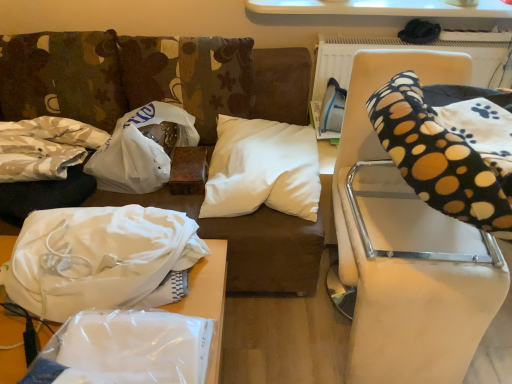
Question: Is transparent plastic bag at lower left, acting as the second furniture starting from the right, surrounding white fabric at left, which ranks as the 3th material in right-to-left order?

Choices:
 (A) no
 (B) yes

Answer: (A)

Question: From the image's perspective, is transparent plastic bag at lower left, acting as the second furniture starting from the right, located above white fabric at left, the 1th material in the left-to-right sequence?

Choices:
 (A) no
 (B) yes

Answer: (A)

Question: From a real-world perspective, does transparent plastic bag at lower left, arranged as the first furniture when viewed from the left, stand above white fabric at left, which ranks as the 3th material in right-to-left order?

Choices:
 (A) no
 (B) yes

Answer: (A)

Question: Is transparent plastic bag at lower left, acting as the second furniture starting from the right, shorter than white fabric at left, which ranks as the 3th material in right-to-left order?

Choices:
 (A) yes
 (B) no

Answer: (A)

Question: Considering the relative positions of transparent plastic bag at lower left, acting as the second furniture starting from the right, and white fabric at left, which ranks as the 3th material in right-to-left order, in the image provided, is transparent plastic bag at lower left, acting as the second furniture starting from the right, to the left of white fabric at left, which ranks as the 3th material in right-to-left order, from the viewer's perspective?

Choices:
 (A) yes
 (B) no

Answer: (B)

Question: Is transparent plastic bag at lower left, arranged as the first furniture when viewed from the left, situated inside white fabric at lower left, arranged as the 2th material when viewed from the right, or outside?

Choices:
 (A) outside
 (B) inside

Answer: (A)

Question: From their relative heights in the image, would you say transparent plastic bag at lower left, acting as the second furniture starting from the right, is taller or shorter than white fabric at lower left, which appears as the 2th material when viewed from the left?

Choices:
 (A) short
 (B) tall

Answer: (A)

Question: Relative to white fabric at lower left, arranged as the 2th material when viewed from the right, is transparent plastic bag at lower left, acting as the second furniture starting from the right, in front or behind?

Choices:
 (A) front
 (B) behind

Answer: (A)

Question: From a real-world perspective, relative to white fabric at lower left, arranged as the 2th material when viewed from the right, is transparent plastic bag at lower left, arranged as the first furniture when viewed from the left, vertically above or below?

Choices:
 (A) below
 (B) above

Answer: (A)

Question: Considering the positions of black polka dot fabric at right, which appears as the 2th furniture when viewed from the left, and white fabric at left, which ranks as the 3th material in right-to-left order, in the image, is black polka dot fabric at right, which appears as the 2th furniture when viewed from the left, taller or shorter than white fabric at left, which ranks as the 3th material in right-to-left order,?

Choices:
 (A) tall
 (B) short

Answer: (A)

Question: Considering their positions, is black polka dot fabric at right, which appears as the 2th furniture when viewed from the left, located in front of or behind white fabric at left, which ranks as the 3th material in right-to-left order?

Choices:
 (A) front
 (B) behind

Answer: (A)

Question: Is black polka dot fabric at right, arranged as the first furniture when viewed from the right, inside the boundaries of white fabric at left, the 1th material in the left-to-right sequence, or outside?

Choices:
 (A) inside
 (B) outside

Answer: (B)

Question: From the image's perspective, is black polka dot fabric at right, which appears as the 2th furniture when viewed from the left, positioned above or below white fabric at left, the 1th material in the left-to-right sequence?

Choices:
 (A) below
 (B) above

Answer: (A)

Question: In terms of height, does black polka dot bean bag chair at right look taller or shorter compared to black polka dot fabric at right, arranged as the first furniture when viewed from the right?

Choices:
 (A) short
 (B) tall

Answer: (A)

Question: Considering the relative positions of black polka dot bean bag chair at right and black polka dot fabric at right, which appears as the 2th furniture when viewed from the left, in the image provided, is black polka dot bean bag chair at right to the left or to the right of black polka dot fabric at right, which appears as the 2th furniture when viewed from the left,?

Choices:
 (A) left
 (B) right

Answer: (B)